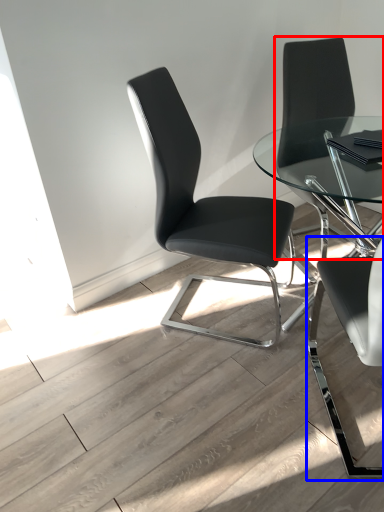
Question: Among these objects, which one is nearest to the camera, chair (highlighted by a red box) or chair (highlighted by a blue box)?

Choices:
 (A) chair
 (B) chair

Answer: (B)